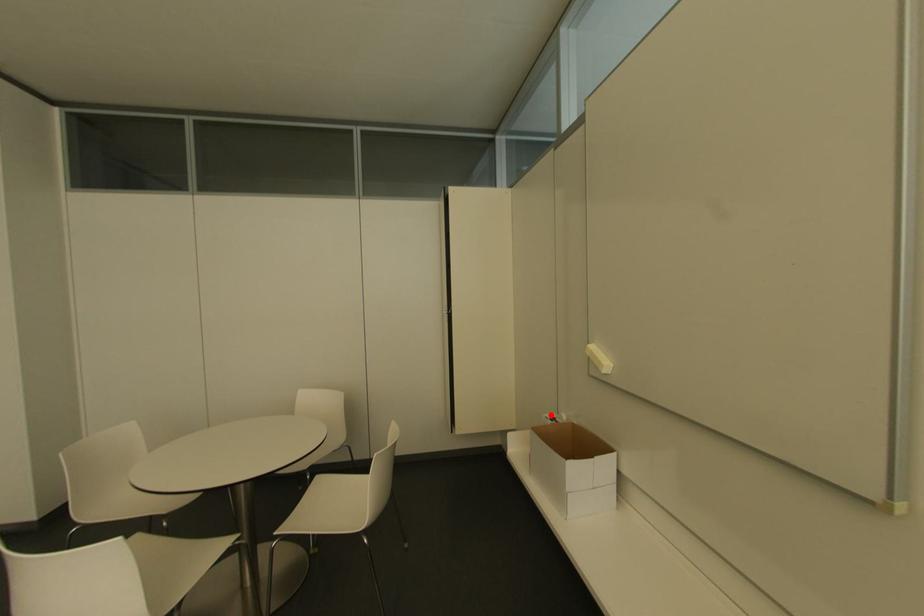
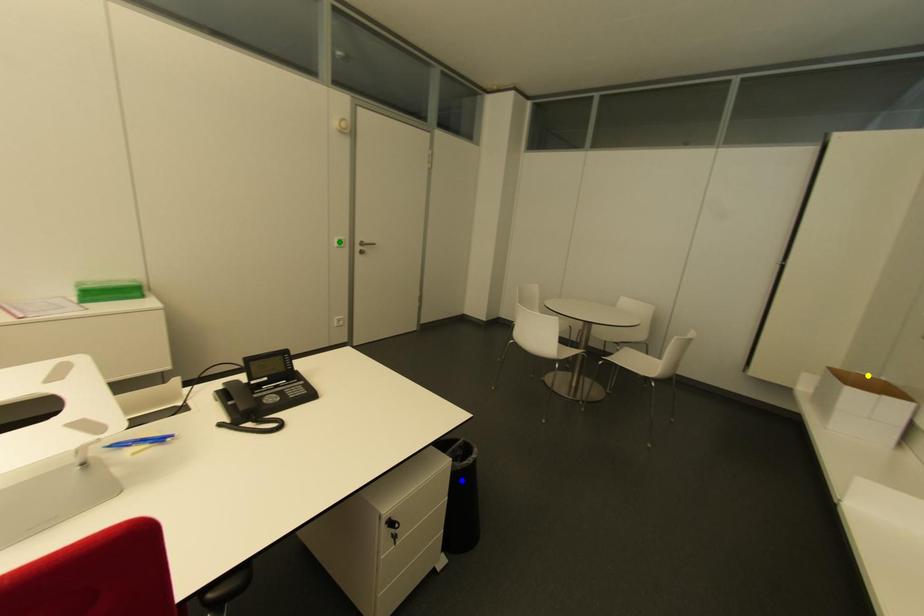
Question: I am providing you with two images of the same scene from different viewpoints. A red point is marked on the first image. You are given multiple points on the second image. Which mark in image 2 goes with the point in image 1?

Choices:
 (A) blue point
 (B) yellow point
 (C) green point

Answer: (B)